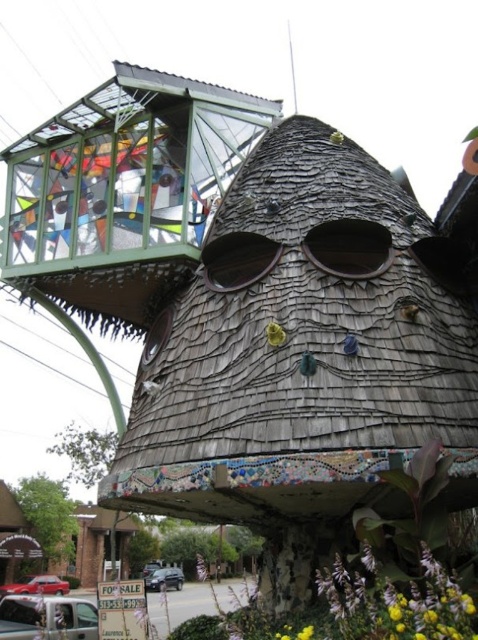
Can you confirm if silver metallic van at lower left is positioned to the left of wooden shingles at lower center?

In fact, silver metallic van at lower left is to the right of wooden shingles at lower center.

Does silver metallic van at lower left have a lesser height compared to wooden shingles at lower center?

No, silver metallic van at lower left is not shorter than wooden shingles at lower center.

Identify the location of silver metallic van at lower left. coord(46,618).

Is wooden shingles at lower center positioned at the back of metallic silver car at lower center?

No.

Can you confirm if wooden shingles at lower center is shorter than metallic silver car at lower center?

In fact, wooden shingles at lower center may be taller than metallic silver car at lower center.

Is point (80, 531) positioned in front of point (152, 570)?

Yes, point (80, 531) is closer to viewer.

This screenshot has height=640, width=478. I want to click on wooden shingles at lower center, so click(x=100, y=544).

Which is below, silver metallic van at lower left or metallic silver car at lower center?

Positioned lower is metallic silver car at lower center.

Image resolution: width=478 pixels, height=640 pixels. Describe the element at coordinates (46, 618) in the screenshot. I see `silver metallic van at lower left` at that location.

The height and width of the screenshot is (640, 478). What do you see at coordinates (46, 618) in the screenshot?
I see `silver metallic van at lower left` at bounding box center [46, 618].

You are a GUI agent. You are given a task and a screenshot of the screen. Output one action in this format:
    pyautogui.click(x=<x>, y=<y>)
    Task: Click on the silver metallic van at lower left
    The image size is (478, 640).
    Given the screenshot: What is the action you would take?
    pyautogui.click(x=46, y=618)